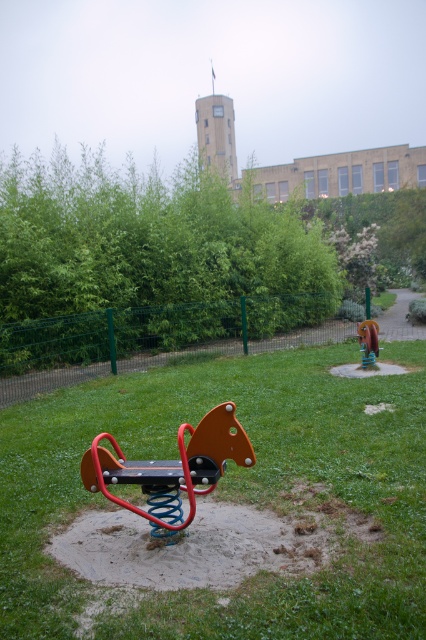
Describe the element at coordinates (172, 468) in the screenshot. I see `orange matte seesaw at center` at that location.

Is orange matte seesaw at center smaller than wooden bench at center?

Actually, orange matte seesaw at center might be larger than wooden bench at center.

Measure the distance between orange matte seesaw at center and camera.

orange matte seesaw at center is 11.20 feet from camera.

Where is `orange matte seesaw at center`? Image resolution: width=426 pixels, height=640 pixels. orange matte seesaw at center is located at coordinates (172, 468).

Is the position of green grassy at center more distant than that of wooden bench at center?

Answer: That is False.

The width and height of the screenshot is (426, 640). What do you see at coordinates (232, 493) in the screenshot?
I see `green grassy at center` at bounding box center [232, 493].

You are a GUI agent. You are given a task and a screenshot of the screen. Output one action in this format:
    pyautogui.click(x=<x>, y=<y>)
    Task: Click on the green grassy at center
    Image resolution: width=426 pixels, height=640 pixels.
    Given the screenshot: What is the action you would take?
    pyautogui.click(x=232, y=493)

Consider the image. Does green grassy at center appear on the left side of orange matte seesaw at center?

Correct, you'll find green grassy at center to the left of orange matte seesaw at center.

Which is behind, point (290, 429) or point (166, 465)?

Positioned behind is point (290, 429).

Image resolution: width=426 pixels, height=640 pixels. What are the coordinates of `green grassy at center` in the screenshot? It's located at (232, 493).